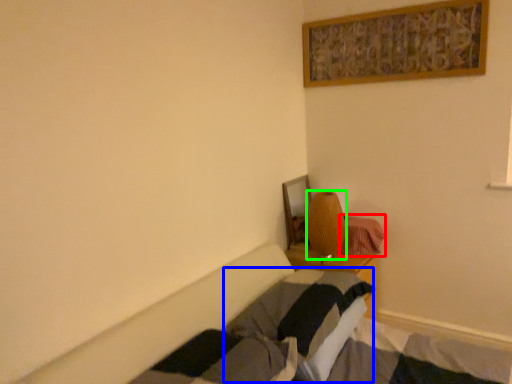
Question: Which object is the farthest from blanket (highlighted by a red box)? Choose among these: pillow (highlighted by a blue box) or lamp (highlighted by a green box).

Choices:
 (A) pillow
 (B) lamp

Answer: (A)